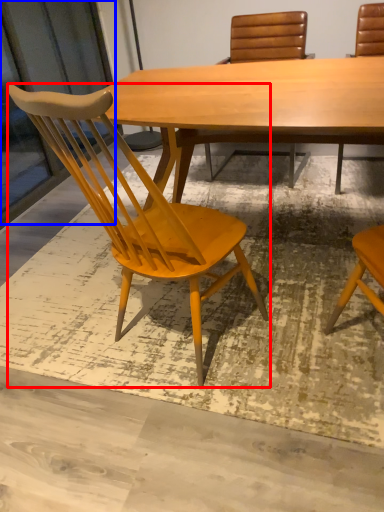
Question: Which object appears farthest to the camera in this image, chair (highlighted by a red box) or screen door (highlighted by a blue box)?

Choices:
 (A) chair
 (B) screen door

Answer: (B)